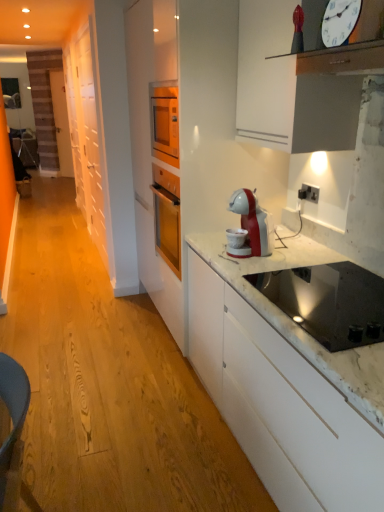
Question: Considering the relative positions of white plastic clock at upper right and black glass cooktop at lower right in the image provided, is white plastic clock at upper right to the right of black glass cooktop at lower right from the viewer's perspective?

Choices:
 (A) no
 (B) yes

Answer: (A)

Question: Would you say white plastic clock at upper right contains black glass cooktop at lower right?

Choices:
 (A) yes
 (B) no

Answer: (B)

Question: Can you confirm if white plastic clock at upper right is thinner than black glass cooktop at lower right?

Choices:
 (A) no
 (B) yes

Answer: (B)

Question: Is white plastic clock at upper right not within black glass cooktop at lower right?

Choices:
 (A) yes
 (B) no

Answer: (A)

Question: Can you confirm if white plastic clock at upper right is taller than black glass cooktop at lower right?

Choices:
 (A) no
 (B) yes

Answer: (B)

Question: Looking at the image, does white plastic clock at upper right seem bigger or smaller compared to black glass cooktop at lower right?

Choices:
 (A) small
 (B) big

Answer: (A)

Question: From a real-world perspective, is white plastic clock at upper right physically located above or below black glass cooktop at lower right?

Choices:
 (A) above
 (B) below

Answer: (A)

Question: In terms of width, does white plastic clock at upper right look wider or thinner when compared to black glass cooktop at lower right?

Choices:
 (A) thin
 (B) wide

Answer: (A)

Question: In the image, is white plastic clock at upper right on the left side or the right side of black glass cooktop at lower right?

Choices:
 (A) left
 (B) right

Answer: (A)

Question: Which is correct: white matte cabinet at left is inside black glass cooktop at lower right, or outside of it?

Choices:
 (A) outside
 (B) inside

Answer: (A)

Question: In the image, is white matte cabinet at left on the left side or the right side of black glass cooktop at lower right?

Choices:
 (A) right
 (B) left

Answer: (B)

Question: From a real-world perspective, is white matte cabinet at left positioned above or below black glass cooktop at lower right?

Choices:
 (A) above
 (B) below

Answer: (A)

Question: Is white matte cabinet at left wider or thinner than black glass cooktop at lower right?

Choices:
 (A) wide
 (B) thin

Answer: (B)

Question: Is white matte cabinet at left to the left or to the right of white plastic electric outlet at upper right in the image?

Choices:
 (A) right
 (B) left

Answer: (B)

Question: From the image's perspective, is white matte cabinet at left located above or below white plastic electric outlet at upper right?

Choices:
 (A) below
 (B) above

Answer: (B)